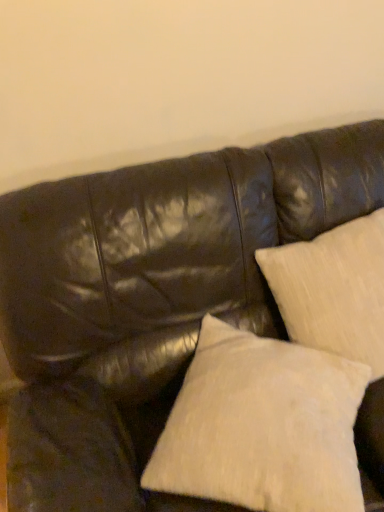
Question: Does beige textured pillow at upper right, the 1th pillow in the right-to-left sequence, turn towards white textured pillow at lower right, which is the second pillow in right-to-left order?

Choices:
 (A) yes
 (B) no

Answer: (B)

Question: From a real-world perspective, is beige textured pillow at upper right, arranged as the second pillow when viewed from the left, on white textured pillow at lower right, which is the second pillow in right-to-left order?

Choices:
 (A) no
 (B) yes

Answer: (B)

Question: Is beige textured pillow at upper right, the 1th pillow in the right-to-left sequence, in front of white textured pillow at lower right, which is the second pillow in right-to-left order?

Choices:
 (A) no
 (B) yes

Answer: (A)

Question: Does beige textured pillow at upper right, the 1th pillow in the right-to-left sequence, have a lesser height compared to white textured pillow at lower right, which is the second pillow in right-to-left order?

Choices:
 (A) yes
 (B) no

Answer: (B)

Question: From a real-world perspective, is beige textured pillow at upper right, arranged as the second pillow when viewed from the left, positioned under white textured pillow at lower right, which is the second pillow in right-to-left order, based on gravity?

Choices:
 (A) no
 (B) yes

Answer: (A)

Question: Is beige textured pillow at upper right, arranged as the second pillow when viewed from the left, completely or partially outside of white textured pillow at lower right, the 1th pillow in the left-to-right sequence?

Choices:
 (A) yes
 (B) no

Answer: (A)

Question: Is white textured pillow at lower right, the 1th pillow in the left-to-right sequence, looking in the opposite direction of beige textured pillow at upper right, arranged as the second pillow when viewed from the left?

Choices:
 (A) yes
 (B) no

Answer: (A)

Question: Is white textured pillow at lower right, which is the second pillow in right-to-left order, with beige textured pillow at upper right, arranged as the second pillow when viewed from the left?

Choices:
 (A) yes
 (B) no

Answer: (B)

Question: From a real-world perspective, is white textured pillow at lower right, which is the second pillow in right-to-left order, positioned under beige textured pillow at upper right, the 1th pillow in the right-to-left sequence, based on gravity?

Choices:
 (A) yes
 (B) no

Answer: (A)

Question: Is beige textured pillow at upper right, arranged as the second pillow when viewed from the left, located within white textured pillow at lower right, which is the second pillow in right-to-left order?

Choices:
 (A) no
 (B) yes

Answer: (A)

Question: Can you confirm if white textured pillow at lower right, the 1th pillow in the left-to-right sequence, is smaller than beige textured pillow at upper right, arranged as the second pillow when viewed from the left?

Choices:
 (A) yes
 (B) no

Answer: (A)

Question: Is white textured pillow at lower right, the 1th pillow in the left-to-right sequence, not near beige textured pillow at upper right, the 1th pillow in the right-to-left sequence?

Choices:
 (A) yes
 (B) no

Answer: (B)

Question: From the image's perspective, is white textured pillow at lower right, the 1th pillow in the left-to-right sequence, positioned above or below beige textured pillow at upper right, arranged as the second pillow when viewed from the left?

Choices:
 (A) below
 (B) above

Answer: (A)